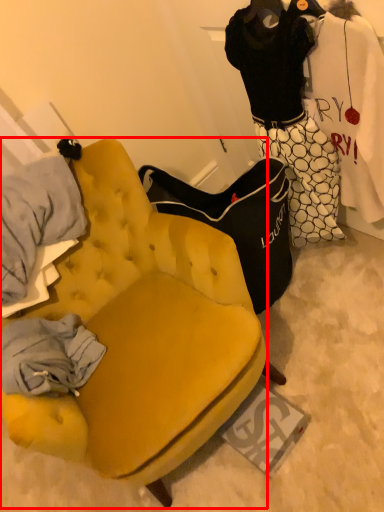
Question: From the image's perspective, considering the relative positions of chair (annotated by the red box) and couple in the image provided, where is chair (annotated by the red box) located with respect to the staircase?

Choices:
 (A) above
 (B) below

Answer: (B)